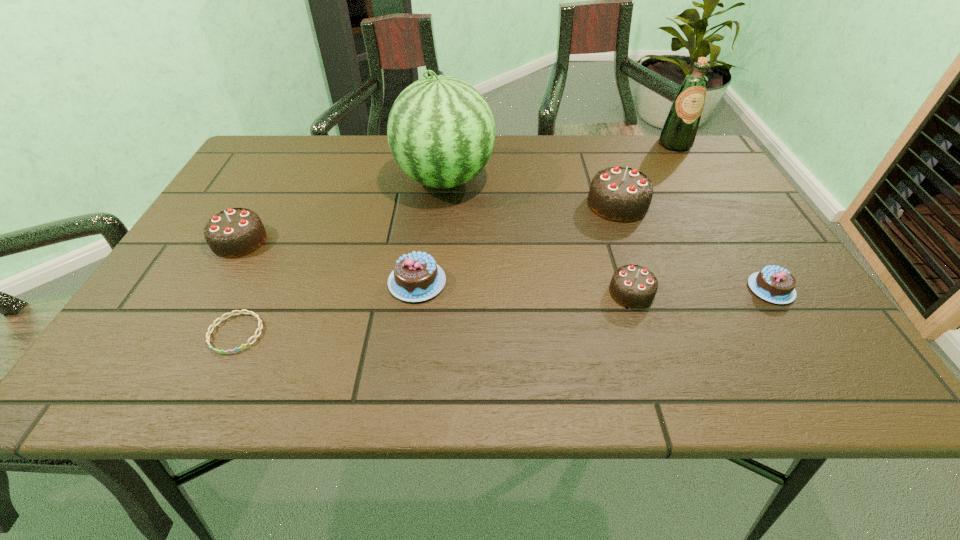
Where is `vacant area situated 0.120m on the left of the smallest chocolate chocolate cake`? The width and height of the screenshot is (960, 540). vacant area situated 0.120m on the left of the smallest chocolate chocolate cake is located at coordinates (550, 292).

Identify the location of free space located on the back of the right pink chocolate cake. (708, 188).

In order to click on free location located 0.050m on the surface of the blue bracelet showing star-shaped elements in this screenshot , I will do `click(214, 379)`.

What are the coordinates of `watermelon positioned at the far edge` in the screenshot? It's located at (441, 132).

You are a GUI agent. You are given a task and a screenshot of the screen. Output one action in this format:
    pyautogui.click(x=<x>, y=<y>)
    Task: Click on the olive oil that is at the far edge
    The height and width of the screenshot is (540, 960).
    Given the screenshot: What is the action you would take?
    pyautogui.click(x=678, y=134)

The width and height of the screenshot is (960, 540). I want to click on object that is positioned at the near edge, so click(x=213, y=325).

Identify the location of chocolate cake present at the left edge. The height and width of the screenshot is (540, 960). (235, 232).

You are a GUI agent. You are given a task and a screenshot of the screen. Output one action in this format:
    pyautogui.click(x=<x>, y=<y>)
    Task: Click on the bracelet that is positioned at the left edge
    Image resolution: width=960 pixels, height=540 pixels.
    Given the screenshot: What is the action you would take?
    pyautogui.click(x=213, y=325)

What are the coordinates of `olive oil present at the right edge` in the screenshot? It's located at (678, 134).

The width and height of the screenshot is (960, 540). What are the coordinates of `chocolate cake at the right edge` in the screenshot? It's located at (774, 284).